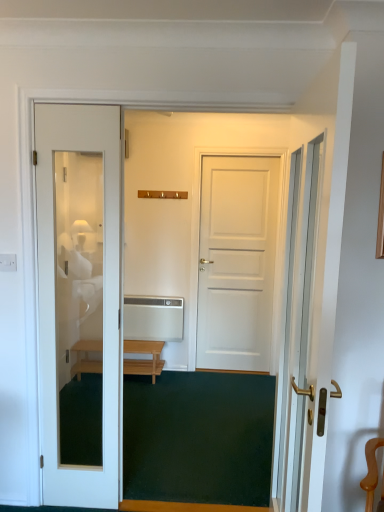
Question: Should I look upward or downward to see light wood/matte finish bench at center?

Choices:
 (A) down
 (B) up

Answer: (A)